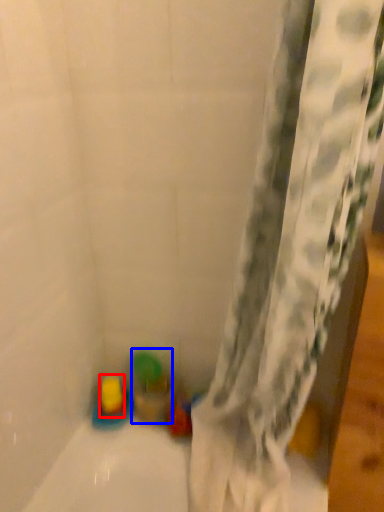
Question: Which object appears farthest to the camera in this image, toy (highlighted by a red box) or toy (highlighted by a blue box)?

Choices:
 (A) toy
 (B) toy

Answer: (A)